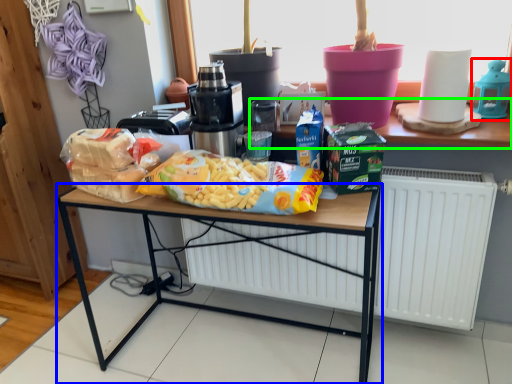
Question: Estimate the real-world distances between objects in this image. Which object is farther from appliance (highlighted by a red box), desk (highlighted by a blue box) or window sill (highlighted by a green box)?

Choices:
 (A) desk
 (B) window sill

Answer: (A)